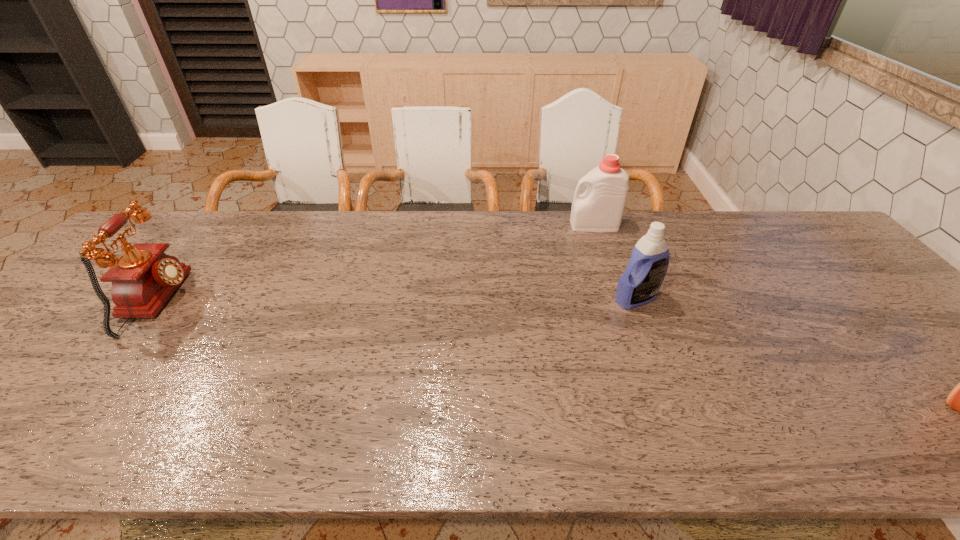
The width and height of the screenshot is (960, 540). What are the coordinates of `object that is the second nearest to the farthest detergent` in the screenshot? It's located at (959, 399).

Choose which object is the third nearest neighbor to the second nearest detergent. Please provide its 2D coordinates. Your answer should be formatted as a tuple, i.e. [(x, y)], where the tuple contains the x and y coordinates of a point satisfying the conditions above.

[(143, 279)]

Where is `the second closest detergent relative to the telephone`? The height and width of the screenshot is (540, 960). the second closest detergent relative to the telephone is located at coordinates (645, 272).

Locate which detergent is the closest to the nearest object. Please provide its 2D coordinates. Your answer should be formatted as a tuple, i.e. [(x, y)], where the tuple contains the x and y coordinates of a point satisfying the conditions above.

[(645, 272)]

What are the coordinates of `vacant region that satisfies the following two spatial constraints: 1. on the back side of the second nearest detergent; 2. on the handle side of the farthest object` in the screenshot? It's located at (608, 225).

Locate an element on the screen. This screenshot has width=960, height=540. vacant area in the image that satisfies the following two spatial constraints: 1. on the handle side of the second nearest detergent; 2. on the left side of the farthest detergent is located at coordinates (619, 299).

At what (x,y) coordinates should I click in order to perform the action: click on vacant space that satisfies the following two spatial constraints: 1. on the handle side of the farthest detergent; 2. on the right side of the second nearest detergent. Please return your answer as a coordinate pair (x, y). This screenshot has width=960, height=540. Looking at the image, I should click on click(619, 299).

This screenshot has width=960, height=540. Find the location of `vacant space that satisfies the following two spatial constraints: 1. on the front side of the second farthest detergent; 2. on the dial of the telephone`. vacant space that satisfies the following two spatial constraints: 1. on the front side of the second farthest detergent; 2. on the dial of the telephone is located at coordinates (637, 302).

Image resolution: width=960 pixels, height=540 pixels. Identify the location of blank area in the image that satisfies the following two spatial constraints: 1. on the handle side of the farthest object; 2. on the left side of the second farthest detergent. (619, 299).

In order to click on free region that satisfies the following two spatial constraints: 1. on the back side of the second nearest detergent; 2. on the handle side of the farthest object in this screenshot , I will do 608,225.